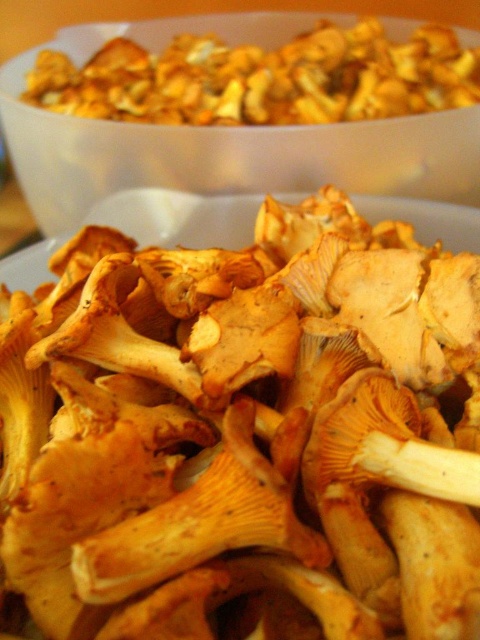
You are holding a ruler and want to measure the distance between the two points in the image of the mushrooms. Which point is closer to you, point (72, 136) or point (409, 100)?

Point (72, 136) is closer to the viewer than point (409, 100).